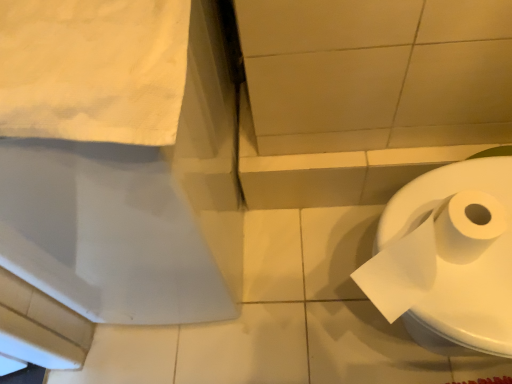
What do you see at coordinates (448, 259) in the screenshot? The height and width of the screenshot is (384, 512). I see `white matte toilet paper at lower right` at bounding box center [448, 259].

This screenshot has height=384, width=512. Find the location of `white matte toilet paper at lower right`. white matte toilet paper at lower right is located at coordinates (448, 259).

This screenshot has width=512, height=384. Identify the location of white matte toilet paper at lower right. (448, 259).